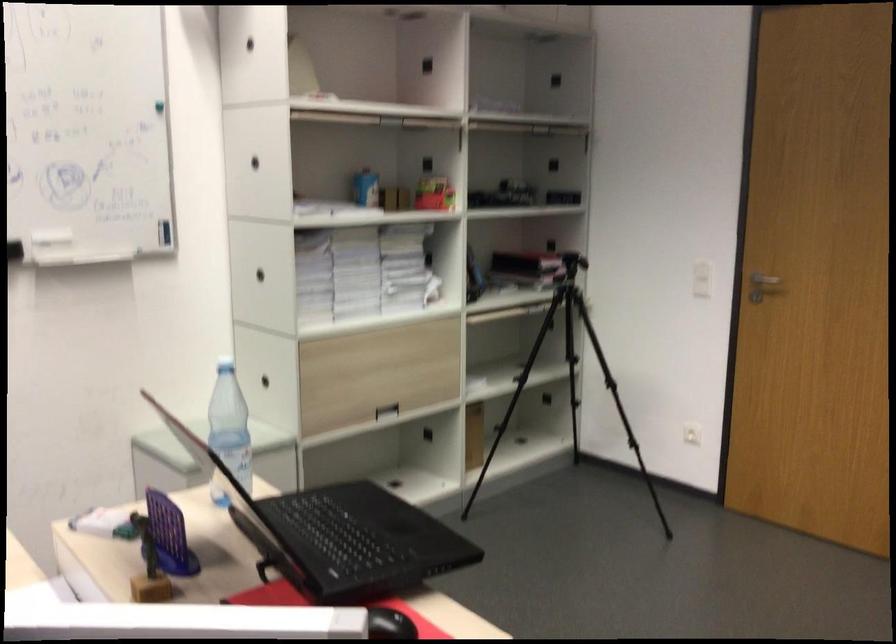
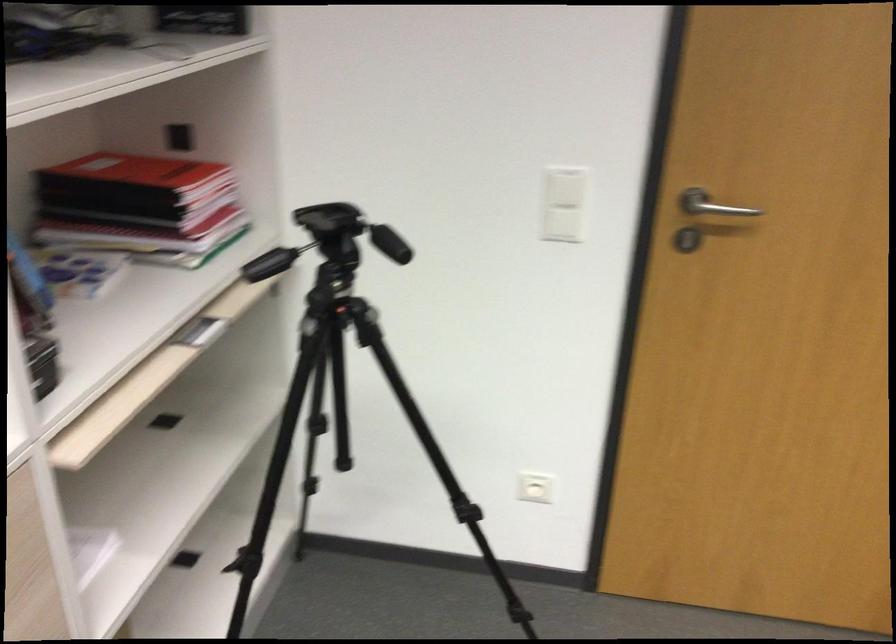
Where in the second image is the point corresponding to (x=777, y=276) from the first image?

(711, 205)